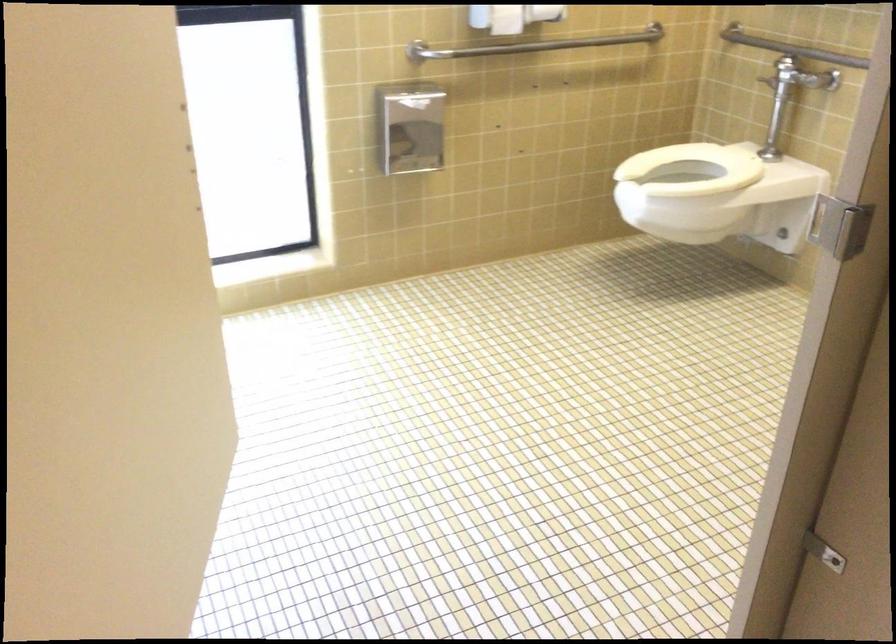
Find the location of a particular element. toilet flush handle is located at coordinates pos(773,82).